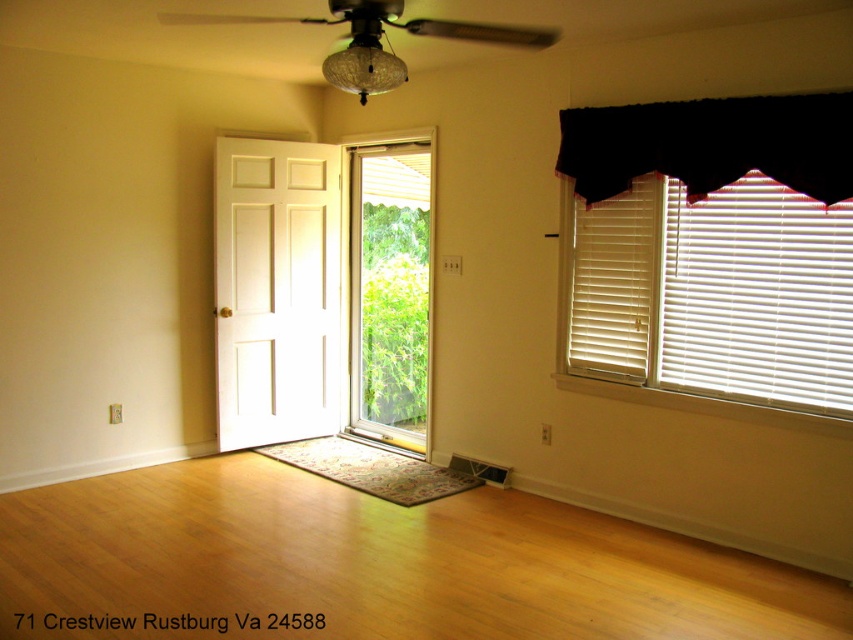
Question: Which of the following is the closest to the observer?

Choices:
 (A) black fabric valance at upper right
 (B) white glossy screen door at center
 (C) white wood blinds at right

Answer: (A)

Question: Is white wood blinds at right positioned in front of white glossy screen door at center?

Choices:
 (A) yes
 (B) no

Answer: (A)

Question: Which point is farther to the camera?

Choices:
 (A) (287, 310)
 (B) (711, 380)

Answer: (A)

Question: Estimate the real-world distances between objects in this image. Which object is closer to the white wood blinds at right?

Choices:
 (A) matte glass ceiling fan at upper center
 (B) black fabric valance at upper right
 (C) white glossy screen door at center

Answer: (B)

Question: Is white wood blinds at right below black fabric valance at upper right?

Choices:
 (A) no
 (B) yes

Answer: (B)

Question: Can you confirm if white glossy screen door at center is positioned to the right of matte glass ceiling fan at upper center?

Choices:
 (A) no
 (B) yes

Answer: (A)